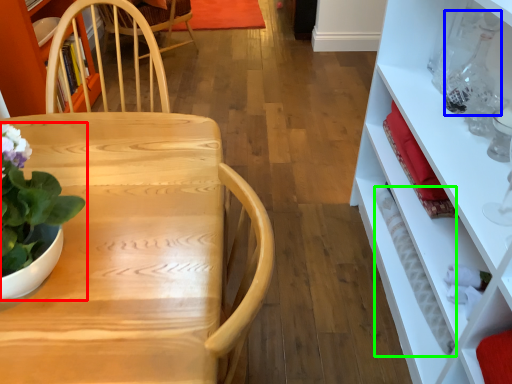
Question: Which object is the closest to the houseplant (highlighted by a red box)? Choose among these: bottle (highlighted by a blue box) or bottle (highlighted by a green box).

Choices:
 (A) bottle
 (B) bottle

Answer: (B)